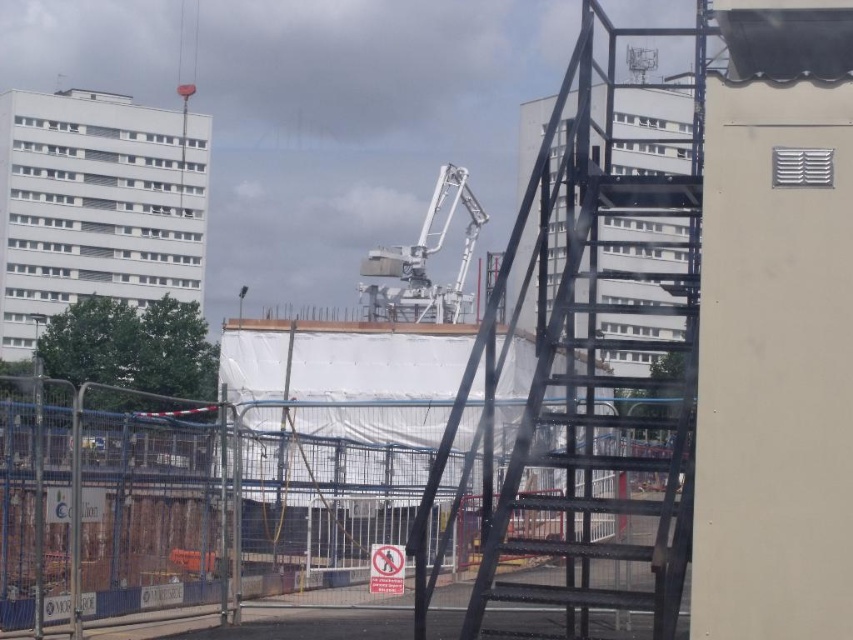
Question: Which point is farther from the camera taking this photo?

Choices:
 (A) (189, 445)
 (B) (582, 536)

Answer: (A)

Question: Among these objects, which one is farthest from the camera?

Choices:
 (A) blue metal fence at center
 (B) black metal ladder at center

Answer: (B)

Question: Can you confirm if blue metal fence at center is positioned below black metal ladder at center?

Choices:
 (A) yes
 (B) no

Answer: (A)

Question: Considering the relative positions of blue metal fence at center and black metal ladder at center in the image provided, where is blue metal fence at center located with respect to black metal ladder at center?

Choices:
 (A) below
 (B) above

Answer: (A)

Question: Observing the image, what is the correct spatial positioning of blue metal fence at center in reference to black metal ladder at center?

Choices:
 (A) above
 (B) below

Answer: (B)